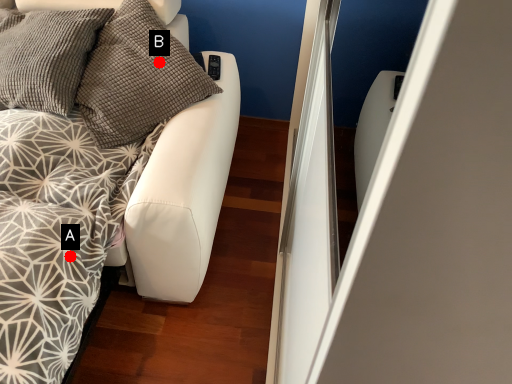
Question: Two points are circled on the image, labeled by A and B beside each circle. Which point is further to the camera?

Choices:
 (A) A is further
 (B) B is further

Answer: (B)